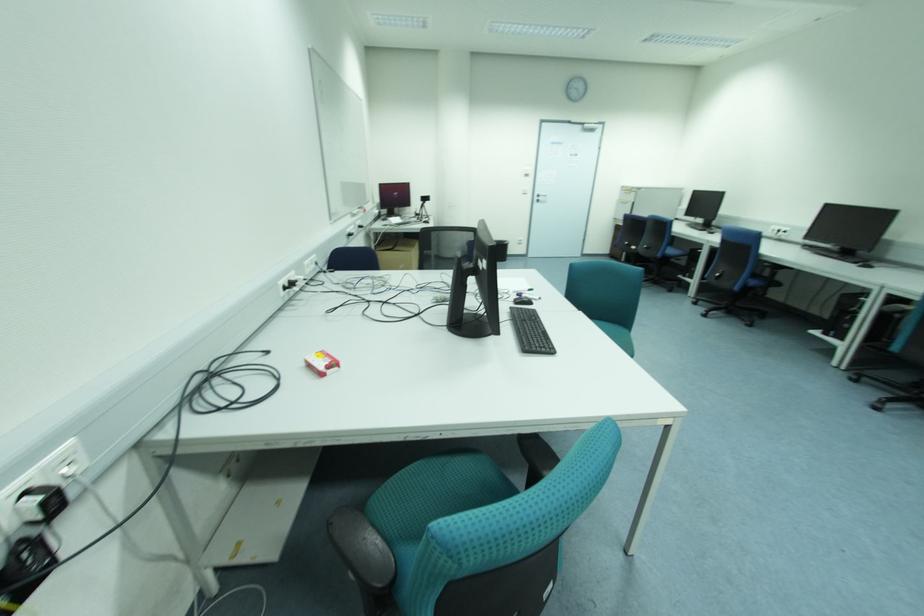
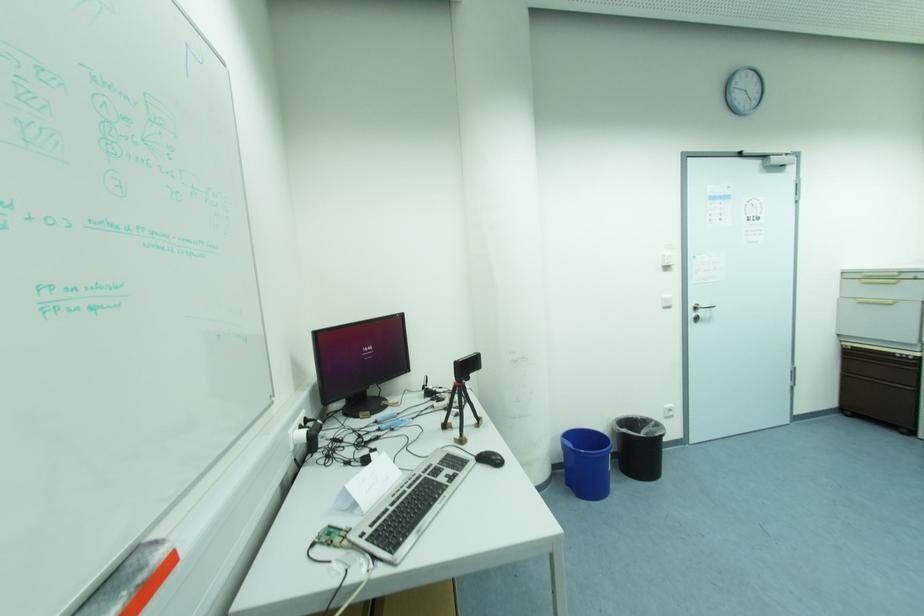
Find the pixel in the second image that matches [622,203] in the first image.

(862, 304)